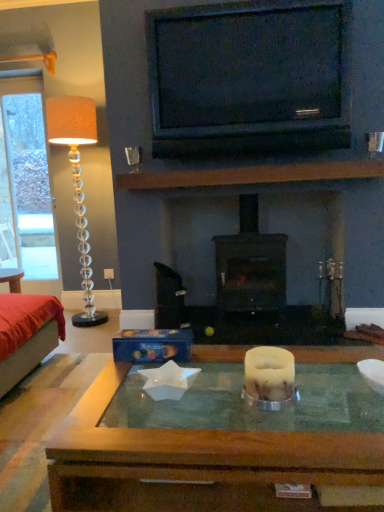
Question: Considering the relative positions of translucent glass floor lamp at left and white wax candle at center in the image provided, is translucent glass floor lamp at left in front of white wax candle at center?

Choices:
 (A) yes
 (B) no

Answer: (B)

Question: Is translucent glass floor lamp at left thinner than white wax candle at center?

Choices:
 (A) yes
 (B) no

Answer: (B)

Question: From the image's perspective, is translucent glass floor lamp at left under white wax candle at center?

Choices:
 (A) yes
 (B) no

Answer: (B)

Question: From the image's perspective, would you say translucent glass floor lamp at left is positioned over white wax candle at center?

Choices:
 (A) yes
 (B) no

Answer: (A)

Question: Can you confirm if translucent glass floor lamp at left is positioned to the left of white wax candle at center?

Choices:
 (A) yes
 (B) no

Answer: (A)

Question: Is white wax candle at center at the back of translucent glass floor lamp at left?

Choices:
 (A) no
 (B) yes

Answer: (A)

Question: Is white wax candle at center with black glossy tv at upper center?

Choices:
 (A) yes
 (B) no

Answer: (B)

Question: Does white wax candle at center come in front of black glossy tv at upper center?

Choices:
 (A) no
 (B) yes

Answer: (B)

Question: From the image's perspective, is white wax candle at center below black glossy tv at upper center?

Choices:
 (A) yes
 (B) no

Answer: (A)

Question: Considering the relative sizes of white wax candle at center and black glossy tv at upper center in the image provided, is white wax candle at center smaller than black glossy tv at upper center?

Choices:
 (A) no
 (B) yes

Answer: (B)

Question: Is white wax candle at center facing towards black glossy tv at upper center?

Choices:
 (A) no
 (B) yes

Answer: (A)

Question: Is black glossy tv at upper center completely or partially inside white wax candle at center?

Choices:
 (A) yes
 (B) no

Answer: (B)

Question: From the image's perspective, does black glossy tv at upper center appear higher than white wax candle at center?

Choices:
 (A) yes
 (B) no

Answer: (A)